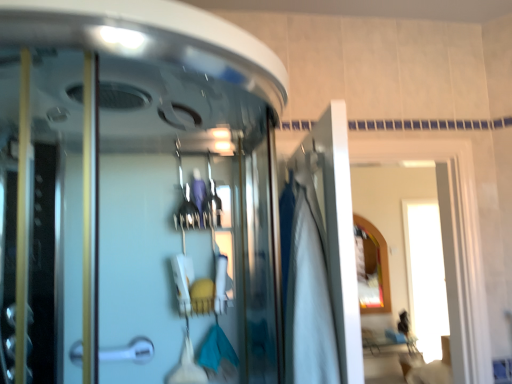
Question: Is white fabric at center taller than matte gold mirror at upper right?

Choices:
 (A) no
 (B) yes

Answer: (A)

Question: Is white fabric at center touching matte gold mirror at upper right?

Choices:
 (A) yes
 (B) no

Answer: (B)

Question: From a real-world perspective, is white fabric at center located beneath matte gold mirror at upper right?

Choices:
 (A) yes
 (B) no

Answer: (B)

Question: Is white fabric at center further to the viewer compared to matte gold mirror at upper right?

Choices:
 (A) no
 (B) yes

Answer: (A)

Question: From the image's perspective, does white fabric at center appear lower than matte gold mirror at upper right?

Choices:
 (A) no
 (B) yes

Answer: (A)

Question: Could matte gold mirror at upper right be considered to be inside white fabric at center?

Choices:
 (A) no
 (B) yes

Answer: (A)

Question: Is silver metallic door handle at lower left looking in the opposite direction of white fabric at center?

Choices:
 (A) no
 (B) yes

Answer: (A)

Question: From the image's perspective, is silver metallic door handle at lower left beneath white fabric at center?

Choices:
 (A) no
 (B) yes

Answer: (B)

Question: Can you confirm if silver metallic door handle at lower left is positioned to the left of white fabric at center?

Choices:
 (A) no
 (B) yes

Answer: (B)

Question: From a real-world perspective, is silver metallic door handle at lower left on top of white fabric at center?

Choices:
 (A) yes
 (B) no

Answer: (B)

Question: Can you confirm if silver metallic door handle at lower left is wider than white fabric at center?

Choices:
 (A) no
 (B) yes

Answer: (A)

Question: Does silver metallic door handle at lower left have a lesser width compared to white fabric at center?

Choices:
 (A) no
 (B) yes

Answer: (B)

Question: From a real-world perspective, is transparent glass shower door at center beneath white fabric at center?

Choices:
 (A) no
 (B) yes

Answer: (A)